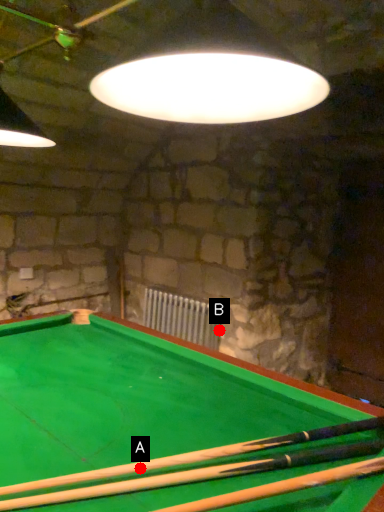
Question: Two points are circled on the image, labeled by A and B beside each circle. Which point is closer to the camera?

Choices:
 (A) A is closer
 (B) B is closer

Answer: (A)